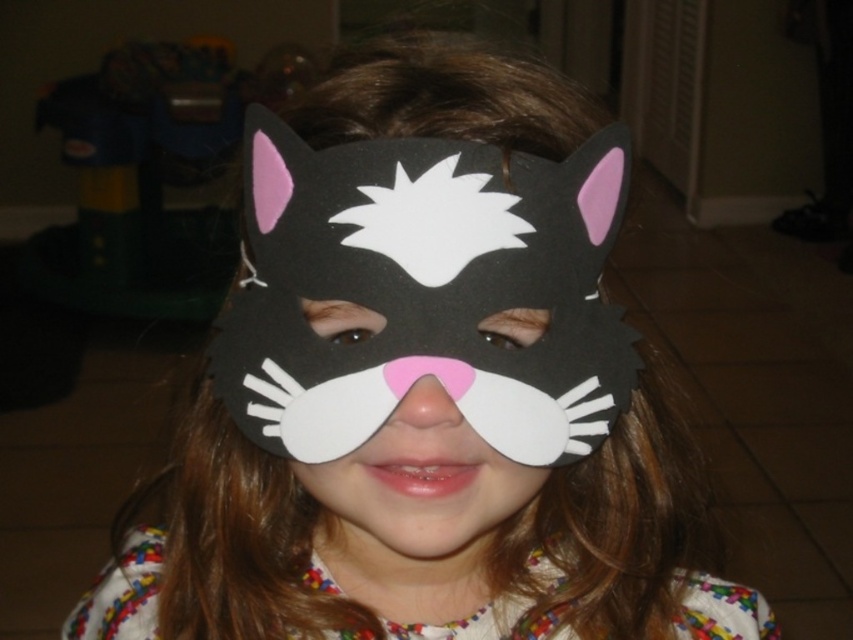
Is matte foam cat mask at center positioned before matte felt mask at center?

Yes, matte foam cat mask at center is in front of matte felt mask at center.

Can you confirm if matte foam cat mask at center is thinner than matte felt mask at center?

Incorrect, matte foam cat mask at center's width is not less than matte felt mask at center's.

Is point (258, 257) closer to camera compared to point (378, 324)?

No.

Where is `matte foam cat mask at center`? matte foam cat mask at center is located at coordinates (425, 291).